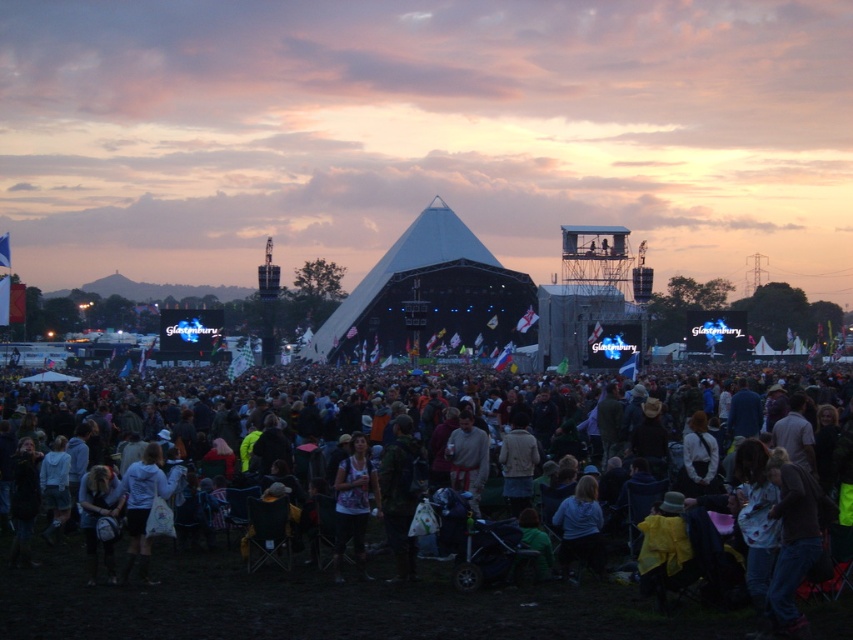
Image resolution: width=853 pixels, height=640 pixels. What do you see at coordinates (374, 576) in the screenshot? I see `dark casual clothing at center` at bounding box center [374, 576].

Measure the distance between dark casual clothing at center and printed fabric shirt at center.

dark casual clothing at center and printed fabric shirt at center are 139.25 feet apart from each other.

I want to click on dark casual clothing at center, so click(374, 576).